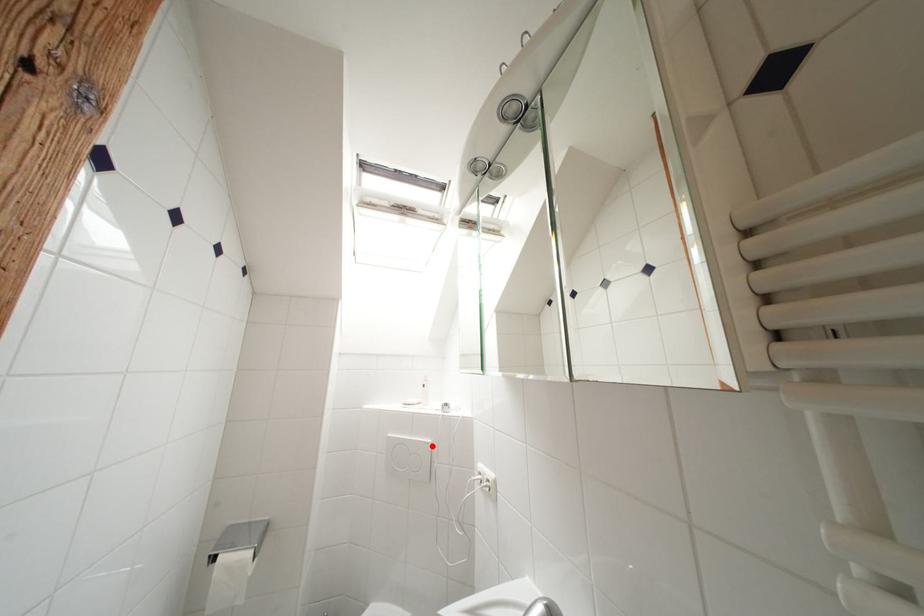
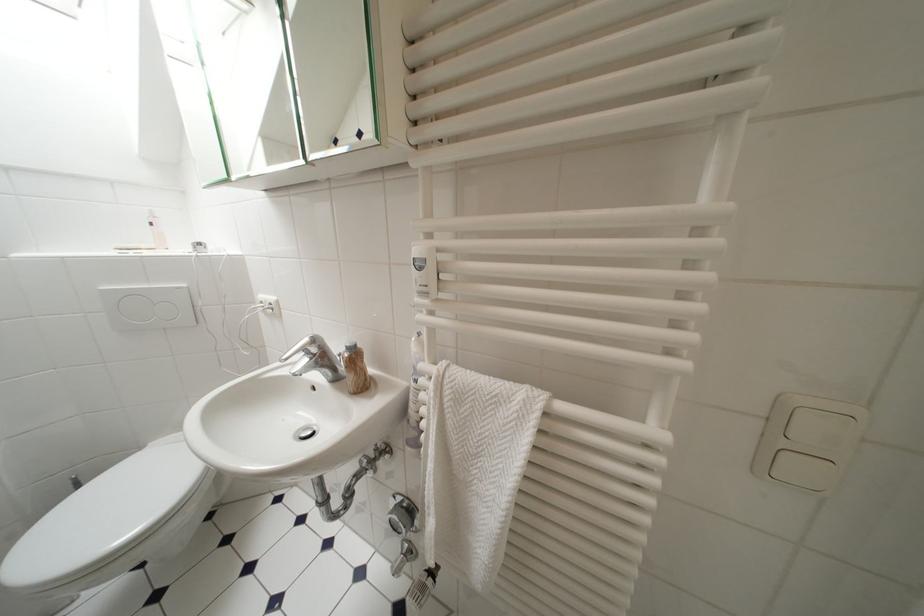
Question: A red point is marked in image1. In image2, is the corresponding 3D point closer to the camera or farther? Reply with the corresponding letter.

Choices:
 (A) The corresponding 3D point is closer.
 (B) The corresponding 3D point is farther.

Answer: (A)